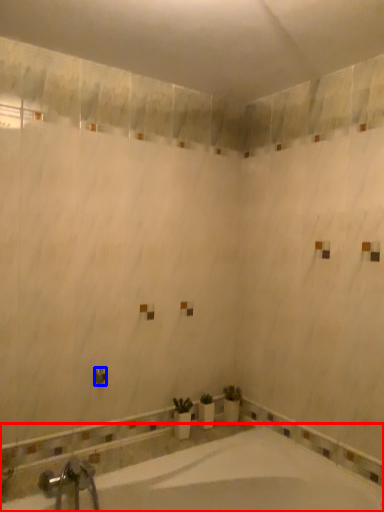
Question: Which point is further to the camera, bathtub (highlighted by a red box) or shower (highlighted by a blue box)?

Choices:
 (A) bathtub
 (B) shower

Answer: (B)